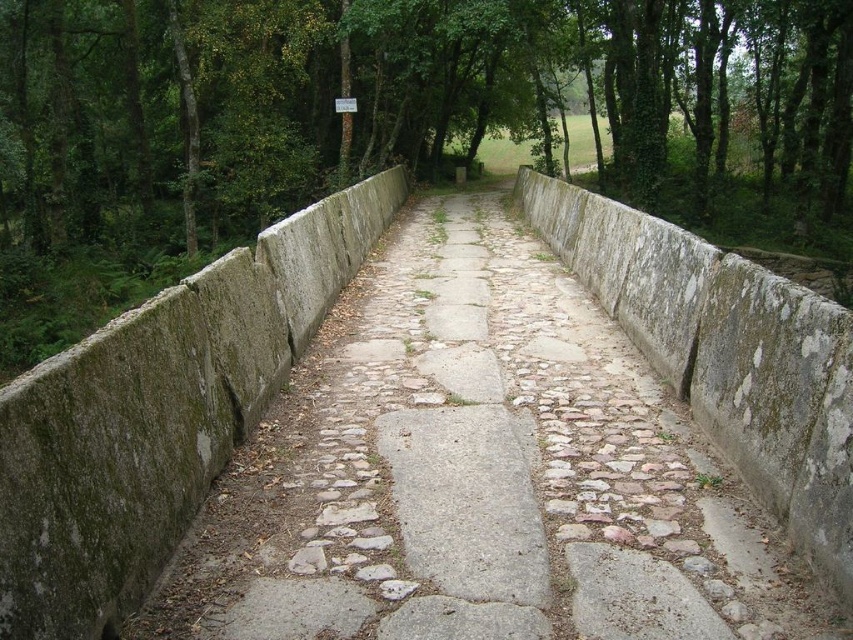
You are standing on the stone bridge and looking at two points marked in the image. Which point, point (364,452) or point (154,93), is nearer to you?

Point (364,452) is closer to the camera than point (154,93), so the point closer to you is point (364,452).

You are a hiker walking along the gray stone path at center and the green leafy tree at center. Which object is directly above the other?

The green leafy tree at center is directly above the gray stone path at center because the gray stone path at center is positioned under it.